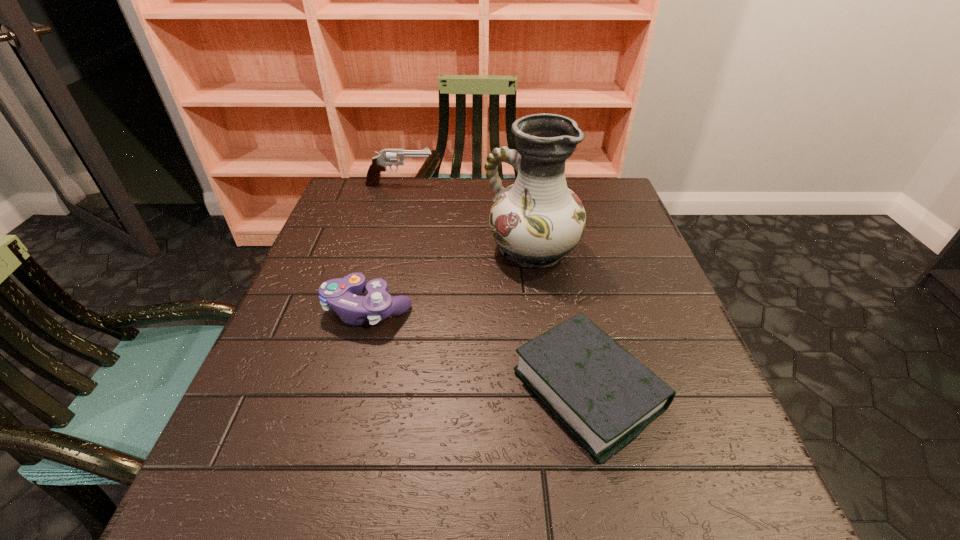
Image resolution: width=960 pixels, height=540 pixels. In order to click on free space that satisfies the following two spatial constraints: 1. at the muzzle of the tallest object; 2. on the left side of the farthest object in this screenshot , I will do pos(382,249).

Where is `free point that satisfies the following two spatial constraints: 1. at the muzzle of the tallest object; 2. on the right side of the gun`? Image resolution: width=960 pixels, height=540 pixels. free point that satisfies the following two spatial constraints: 1. at the muzzle of the tallest object; 2. on the right side of the gun is located at coordinates (382, 249).

Where is `vacant region that satisfies the following two spatial constraints: 1. at the muzzle of the farthest object; 2. on the back side of the vase`? This screenshot has height=540, width=960. vacant region that satisfies the following two spatial constraints: 1. at the muzzle of the farthest object; 2. on the back side of the vase is located at coordinates (382, 249).

The height and width of the screenshot is (540, 960). What are the coordinates of `vacant space that satisfies the following two spatial constraints: 1. at the muzzle of the gun; 2. on the back side of the Bible` in the screenshot? It's located at pyautogui.click(x=344, y=390).

Where is `free point that satisfies the following two spatial constraints: 1. at the muzzle of the second shortest object; 2. on the left side of the gun`? free point that satisfies the following two spatial constraints: 1. at the muzzle of the second shortest object; 2. on the left side of the gun is located at coordinates (366, 309).

The height and width of the screenshot is (540, 960). What are the coordinates of `vacant area that satisfies the following two spatial constraints: 1. at the muzzle of the vase; 2. on the left side of the gun` in the screenshot? It's located at (382, 249).